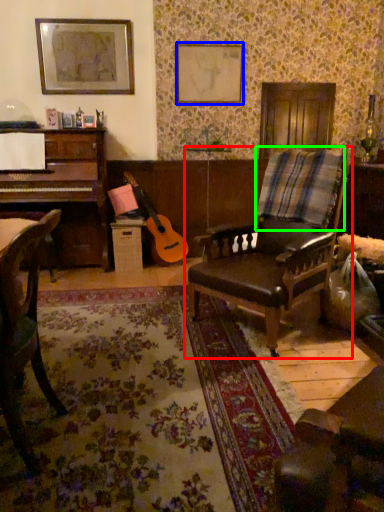
Question: Estimate the real-world distances between objects in this image. Which object is closer to chair (highlighted by a red box), picture frame (highlighted by a blue box) or plaid (highlighted by a green box)?

Choices:
 (A) picture frame
 (B) plaid

Answer: (B)